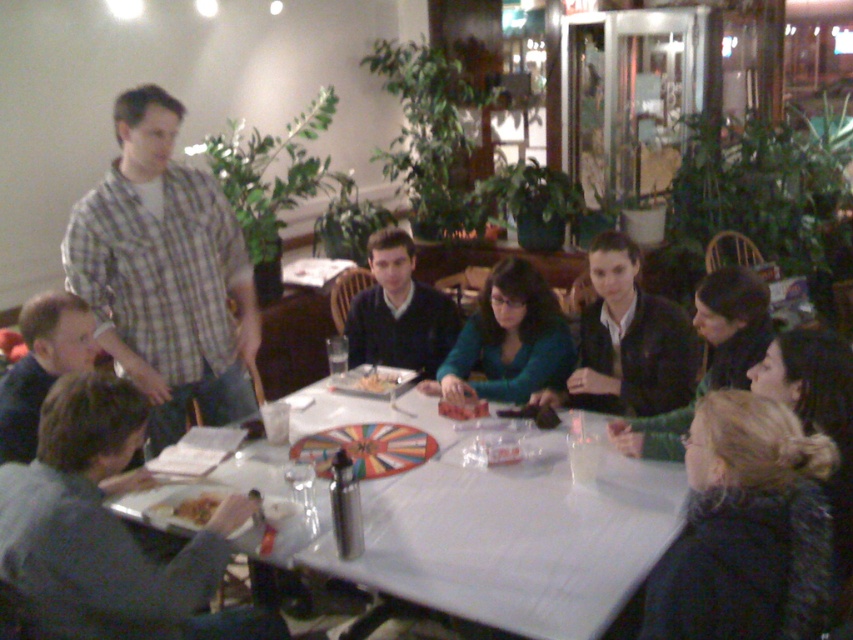
You are a photographer standing at the point marked by coordinates point (509, 339). You want to take a photo of the group around the table. What object is directly in front of you?

The point (509, 339) marks the matte green sweater at center, so the object directly in front of you is the matte green sweater at center.

In the scene shown: You are a waiter at this restaurant and need to place a new drink order at the exact center of the white plastic table at center. The coordinates given are point (508,534). Is this point the correct location to place the drink order at the center of the white plastic table at center?

Yes, the point (508,534) corresponds to the white plastic table at center, so placing the drink order there would be at the exact center of the white plastic table at center.